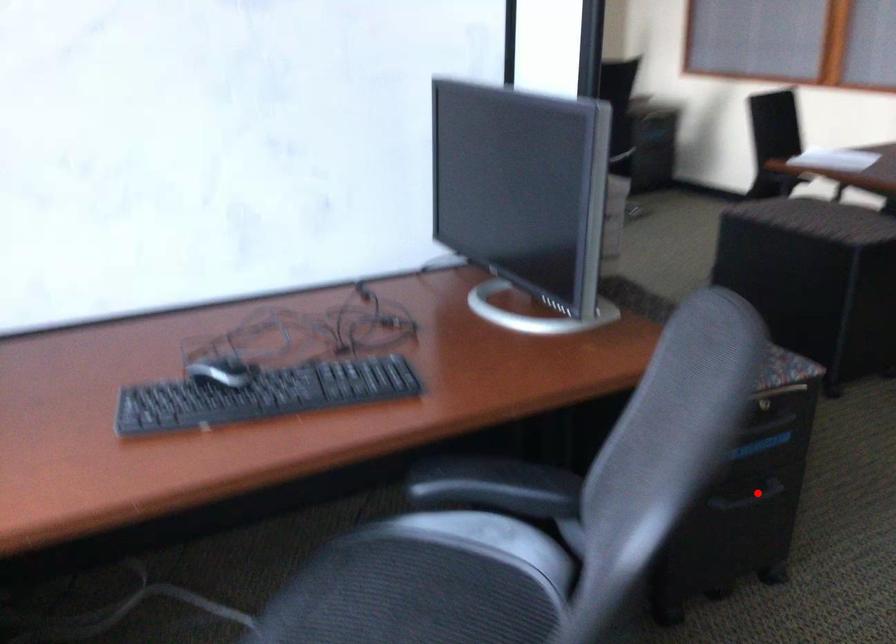
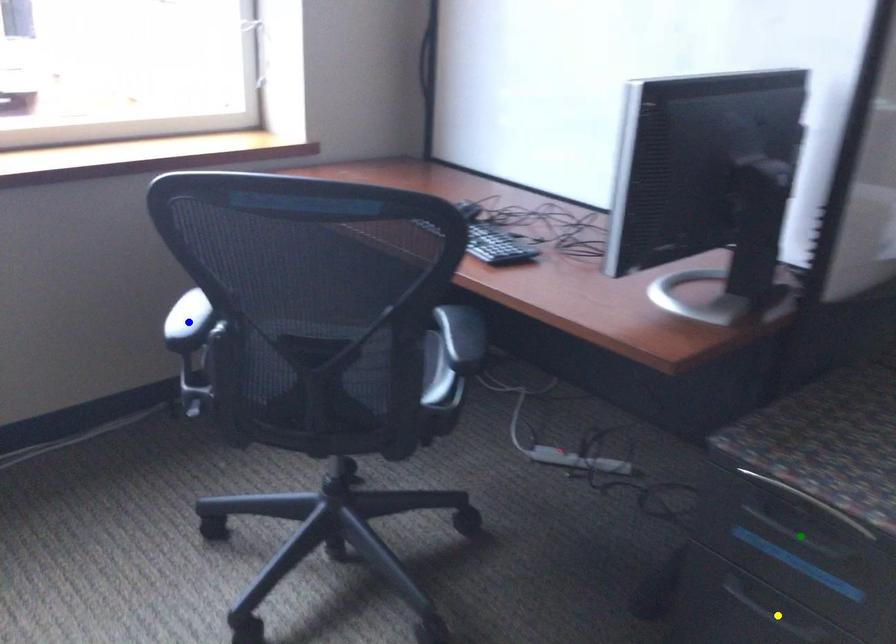
Question: I am providing you with two images of the same scene from different viewpoints. A red point is marked on the first image. You are given multiple points on the second image. Which mark in image 2 goes with the point in image 1?

Choices:
 (A) green point
 (B) yellow point
 (C) blue point

Answer: (B)